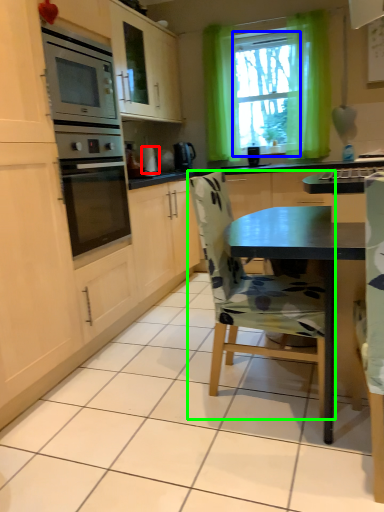
Question: Estimate the real-world distances between objects in this image. Which object is farther from appliance (highlighted by a red box), window screen (highlighted by a blue box) or chair (highlighted by a green box)?

Choices:
 (A) window screen
 (B) chair

Answer: (B)